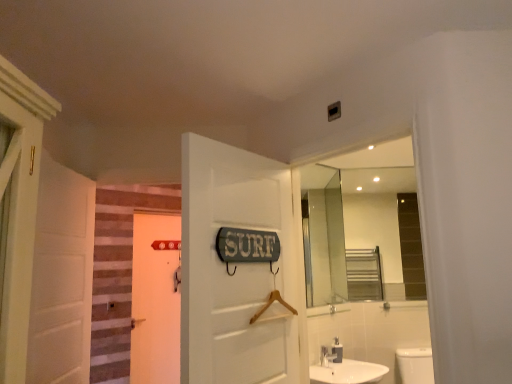
Question: From the image's perspective, is white glossy sink at lower center beneath white matte door at left, the 1th door in the left-to-right sequence?

Choices:
 (A) yes
 (B) no

Answer: (A)

Question: Considering the relative positions of white glossy sink at lower center and white matte door at left, the 3th door in the right-to-left sequence, in the image provided, is white glossy sink at lower center to the right of white matte door at left, the 3th door in the right-to-left sequence, from the viewer's perspective?

Choices:
 (A) no
 (B) yes

Answer: (B)

Question: From a real-world perspective, is white glossy sink at lower center under white matte door at left, the 2th door from the front?

Choices:
 (A) no
 (B) yes

Answer: (B)

Question: Is white glossy sink at lower center bigger than white matte door at left, the 1th door in the left-to-right sequence?

Choices:
 (A) no
 (B) yes

Answer: (A)

Question: Are white glossy sink at lower center and white matte door at left, the 3th door in the right-to-left sequence, making contact?

Choices:
 (A) yes
 (B) no

Answer: (B)

Question: Is white matte door at center, the second door when ordered from right to left, wider or thinner than green painted wood door at center, which is counted as the third door, starting from the left?

Choices:
 (A) wide
 (B) thin

Answer: (B)

Question: Is white matte door at center, which ranks as the second door in left-to-right order, to the left or to the right of green painted wood door at center, which is counted as the third door, starting from the left, in the image?

Choices:
 (A) left
 (B) right

Answer: (A)

Question: From a real-world perspective, is white matte door at center, which ranks as the second door in left-to-right order, above or below green painted wood door at center, the third door when ordered from back to front?

Choices:
 (A) below
 (B) above

Answer: (A)

Question: From the image's perspective, is white matte door at center, the first door in the back-to-front sequence, above or below green painted wood door at center, the third door when ordered from back to front?

Choices:
 (A) below
 (B) above

Answer: (A)

Question: From their relative heights in the image, would you say metallic silver soap dispenser at lower center is taller or shorter than white matte door at left, the 2th door from the front?

Choices:
 (A) short
 (B) tall

Answer: (A)

Question: Is metallic silver soap dispenser at lower center inside the boundaries of white matte door at left, arranged as the second door when viewed from the back, or outside?

Choices:
 (A) inside
 (B) outside

Answer: (B)

Question: Considering the positions of metallic silver soap dispenser at lower center and white matte door at left, the 1th door in the left-to-right sequence, in the image, is metallic silver soap dispenser at lower center bigger or smaller than white matte door at left, the 1th door in the left-to-right sequence,?

Choices:
 (A) small
 (B) big

Answer: (A)

Question: In the image, is metallic silver soap dispenser at lower center on the left side or the right side of white matte door at left, the 3th door in the right-to-left sequence?

Choices:
 (A) left
 (B) right

Answer: (B)

Question: Is white matte door at left, the 3th door in the right-to-left sequence, taller or shorter than white matte door at center, the second door when ordered from right to left?

Choices:
 (A) tall
 (B) short

Answer: (B)

Question: Considering their positions, is white matte door at left, the 2th door from the front, located in front of or behind white matte door at center, which ranks as the second door in left-to-right order?

Choices:
 (A) behind
 (B) front

Answer: (B)